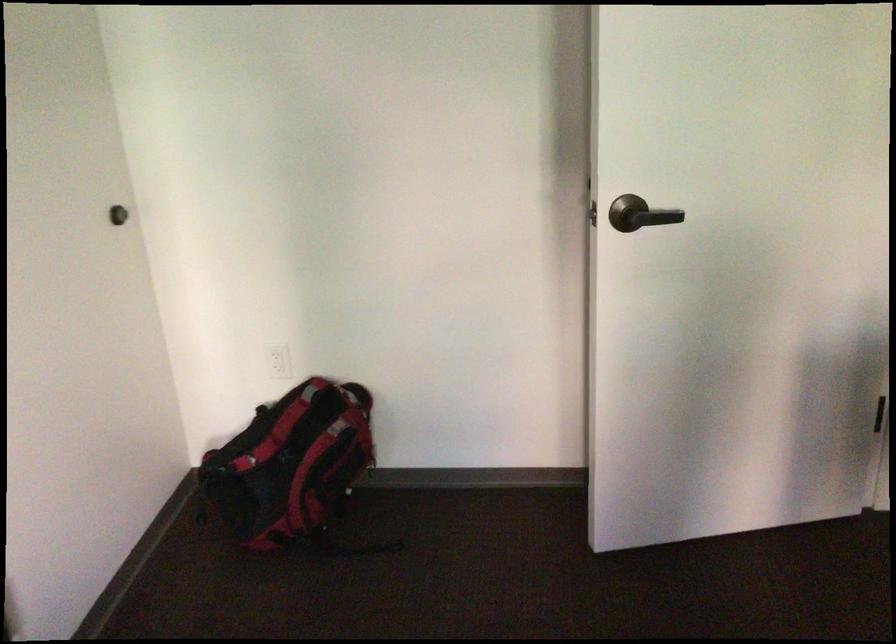
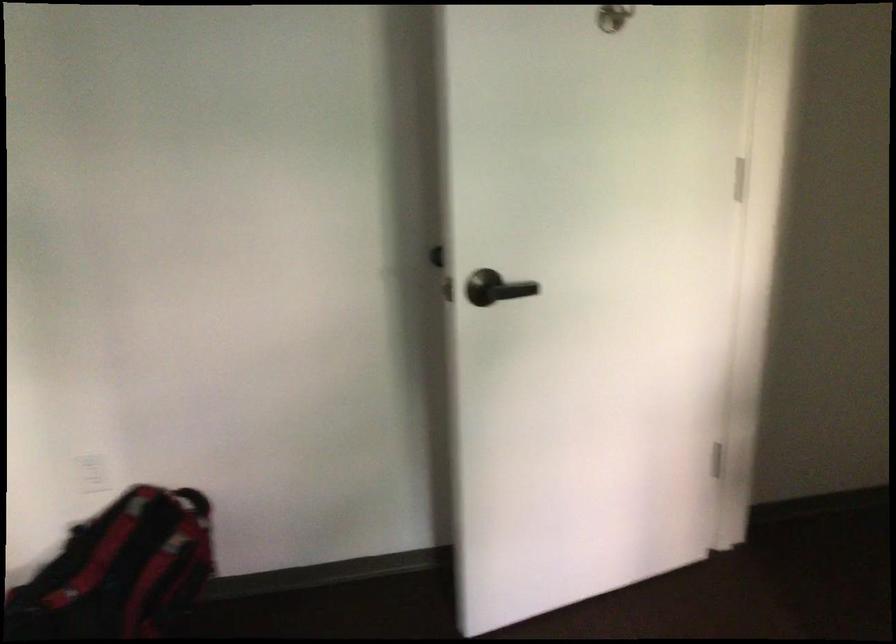
Find the pixel in the second image that matches [289,447] in the first image.

(119, 570)